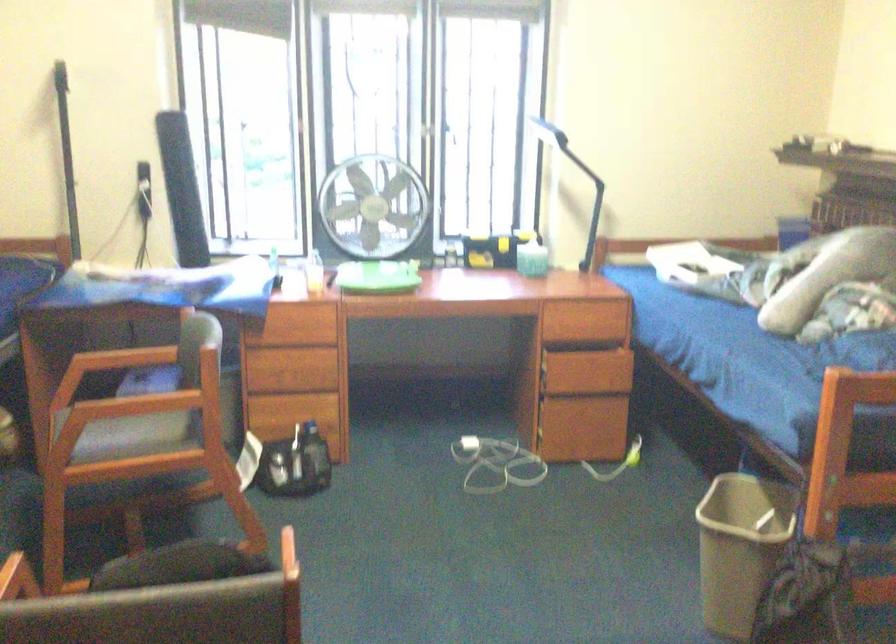
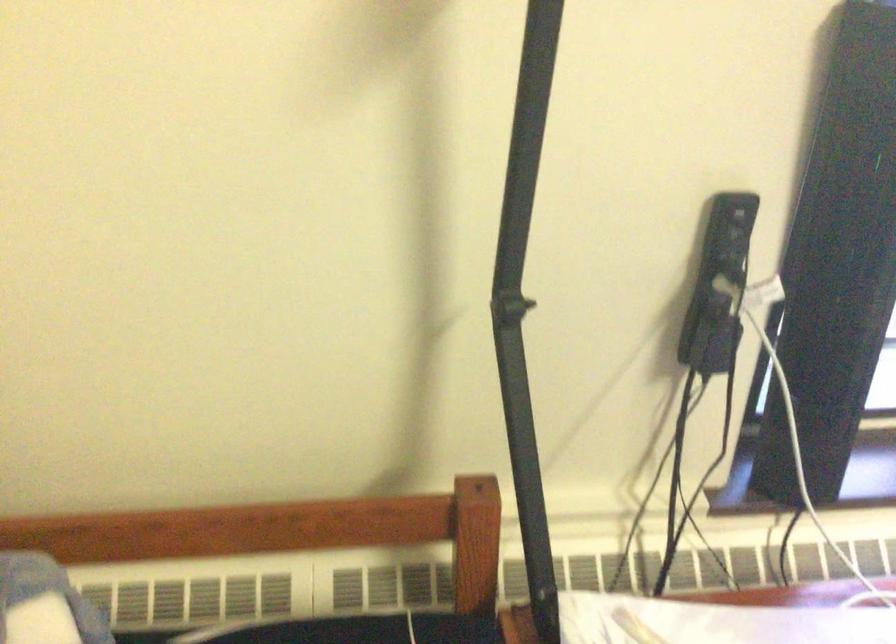
In a continuous first-person perspective shot, in which direction is the camera moving?

The cameraman walked toward left, forward.